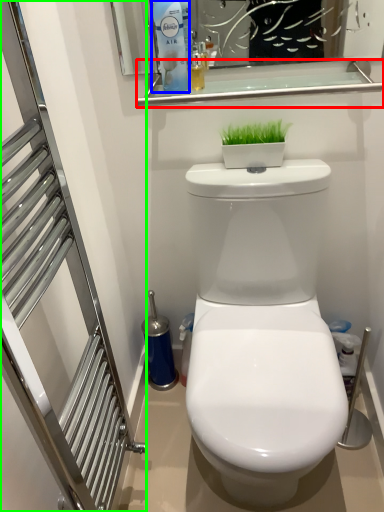
Question: Estimate the real-world distances between objects in this image. Which object is farther from balustrade (highlighted by a red box), cleaning product (highlighted by a blue box) or screen door (highlighted by a green box)?

Choices:
 (A) cleaning product
 (B) screen door

Answer: (B)